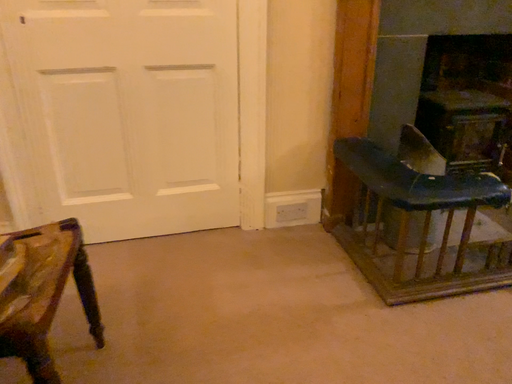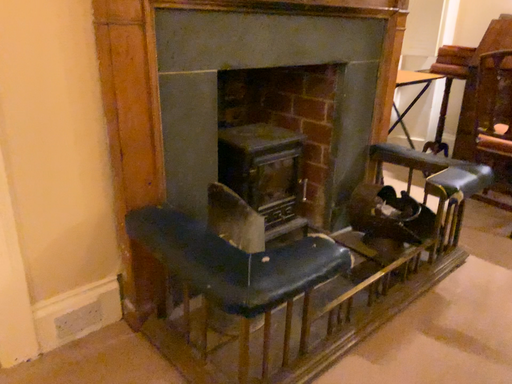
Question: How did the camera likely rotate when shooting the video?

Choices:
 (A) rotated right
 (B) rotated left

Answer: (A)